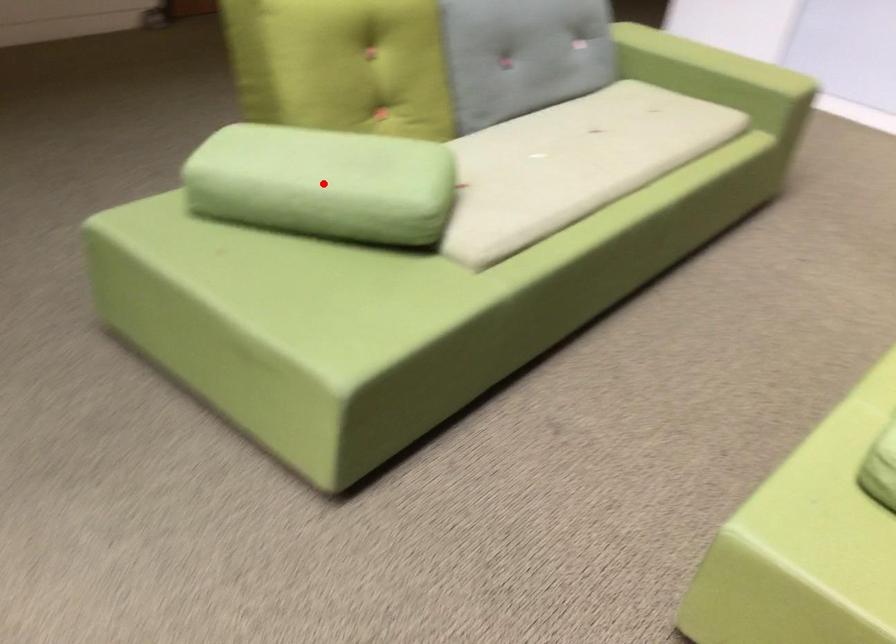
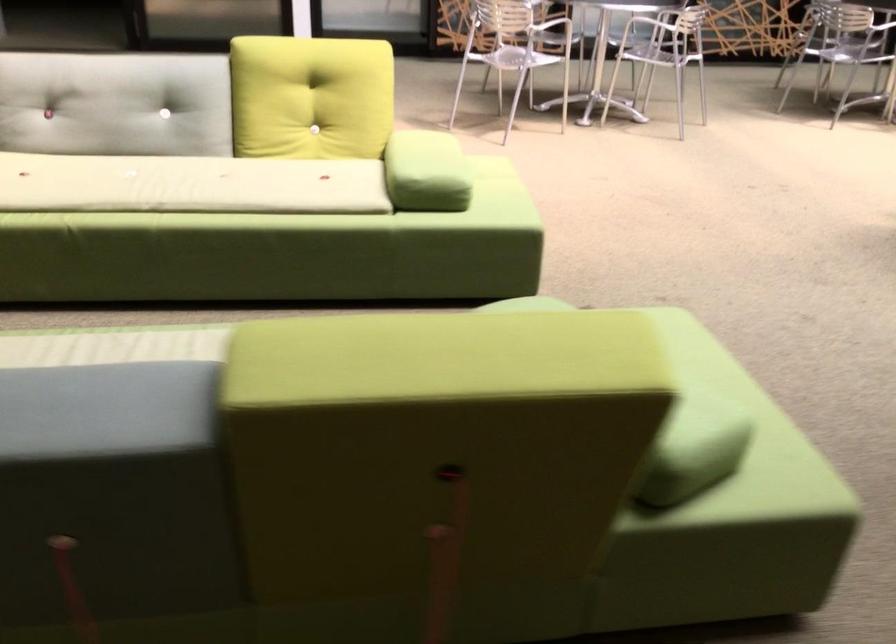
Question: I am providing you with two images of the same scene from different viewpoints. A red point is marked on the first image. Can you still see the location of the red point in image 2?

Choices:
 (A) Yes
 (B) No

Answer: (B)